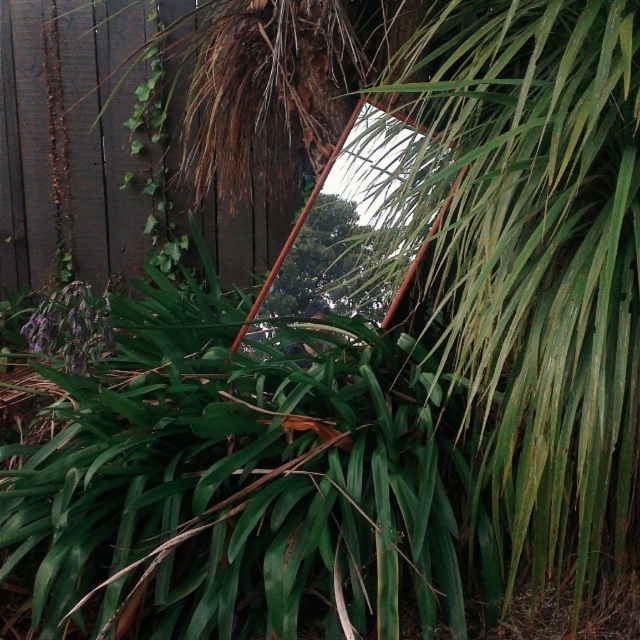
You are a gardener looking to plant a new flower bed between the green leafy tree at center and the purple matte flower at lower left. Considering their sizes, which one might require more space for proper growth?

The green leafy tree at center requires more space for proper growth since it is larger in size than the purple matte flower at lower left.

You are standing in the garden and want to take a photo of the green leafy tree at center. Which direction should you walk to get closer to it?

The green leafy tree at center is located at point [326,268], so you should walk towards the center of the garden to get closer to it.

You are a gardener planning to plant a new tree that requires a minimum of 5 meters of space to grow. Based on the scene, can the green leafy tree at center and the purple matte flower at lower left accommodate this requirement?

The green leafy tree at center is taller than the purple matte flower at lower left, but the exact height of the tree isn generated in the description. Therefore, it is unclear if it meets the 5 meters requirement.